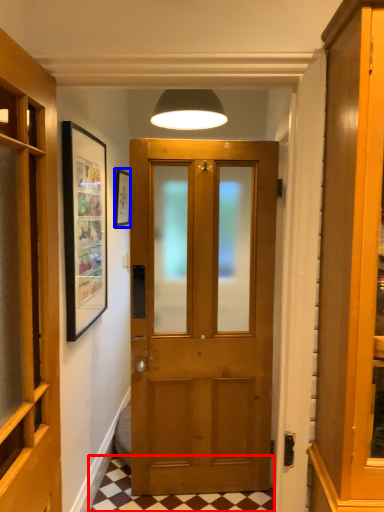
Question: Among these objects, which one is farthest to the camera, tile (highlighted by a red box) or picture frame (highlighted by a blue box)?

Choices:
 (A) tile
 (B) picture frame

Answer: (B)